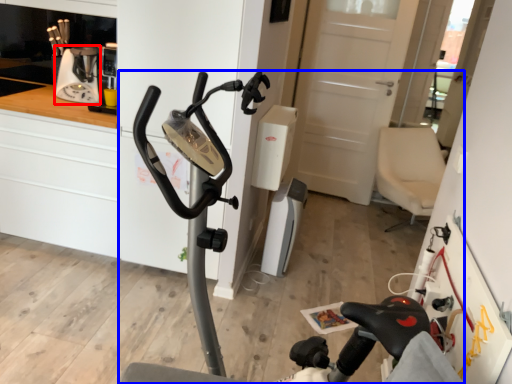
Question: Which point is further to the camera, coffee machine (highlighted by a red box) or stationary bicycle (highlighted by a blue box)?

Choices:
 (A) coffee machine
 (B) stationary bicycle

Answer: (A)